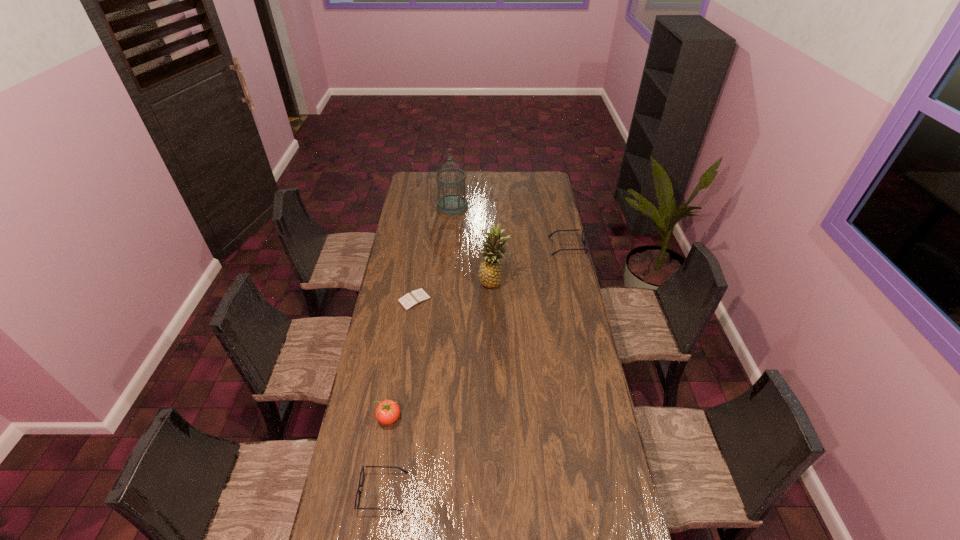
You are a GUI agent. You are given a task and a screenshot of the screen. Output one action in this format:
    pyautogui.click(x=<x>, y=<y>)
    Task: Click on the vacant space situated on the front-facing side of the birdcage
    The width and height of the screenshot is (960, 540).
    Given the screenshot: What is the action you would take?
    pyautogui.click(x=449, y=248)

I want to click on free space located on the front of the pineapple, so click(x=495, y=336).

Where is `free space located on the right of the tomato`? free space located on the right of the tomato is located at coordinates (434, 417).

Where is `object located at the near edge`? The image size is (960, 540). object located at the near edge is located at coordinates (357, 499).

Where is `spectacles located at the left edge`? spectacles located at the left edge is located at coordinates (357, 499).

Image resolution: width=960 pixels, height=540 pixels. What are the coordinates of `diary situated at the left edge` in the screenshot? It's located at (415, 297).

This screenshot has width=960, height=540. What are the coordinates of `tomato located in the left edge section of the desktop` in the screenshot? It's located at pos(387,412).

Find the location of a particular element. This screenshot has height=540, width=960. object present at the right edge is located at coordinates (584, 240).

The width and height of the screenshot is (960, 540). I want to click on object that is at the near left corner, so click(357, 499).

Find the location of a particular element. This screenshot has height=540, width=960. free space at the far edge of the desktop is located at coordinates (510, 176).